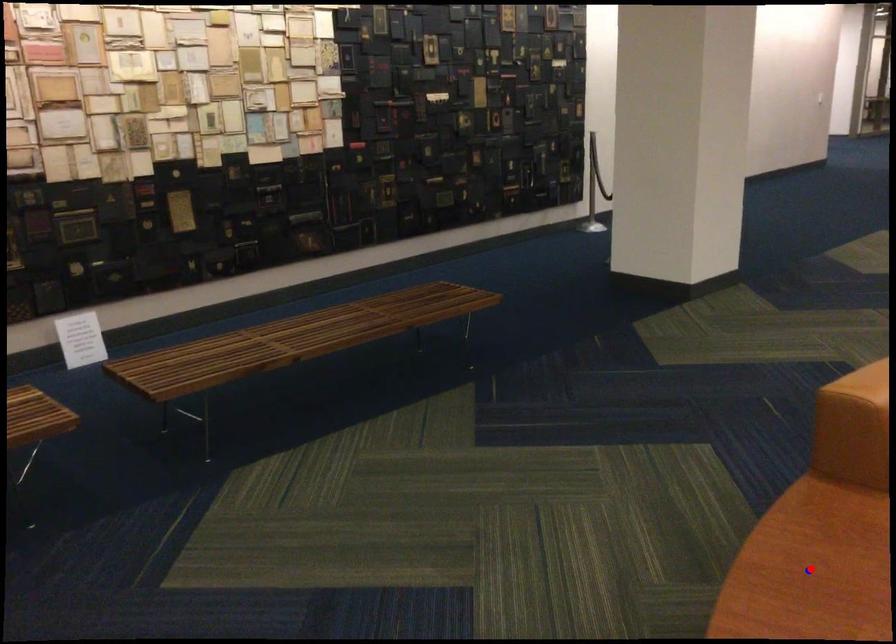
Question: Which of the two points in the image is closer to the camera?

Choices:
 (A) Blue point is closer.
 (B) Red point is closer.

Answer: (A)